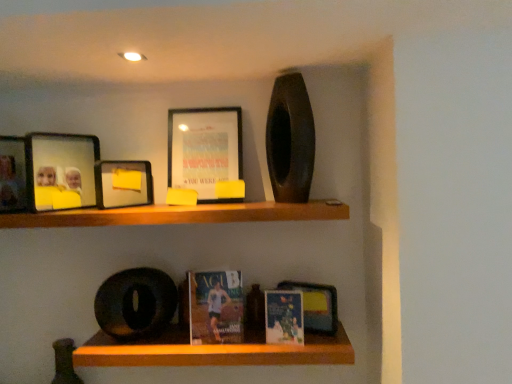
Question: From a real-world perspective, is matte paper book at center, the second paperback book when ordered from left to right, beneath wooden shelf at upper center, placed as the 2th shelf when sorted from bottom to top?

Choices:
 (A) yes
 (B) no

Answer: (A)

Question: Is matte paper book at center, the second paperback book when ordered from left to right, at the left side of wooden shelf at upper center, arranged as the first shelf when viewed from the top?

Choices:
 (A) yes
 (B) no

Answer: (B)

Question: Is matte paper book at center, acting as the first paperback book starting from the right, oriented towards wooden shelf at upper center, placed as the 2th shelf when sorted from bottom to top?

Choices:
 (A) yes
 (B) no

Answer: (B)

Question: Is matte paper book at center, the second paperback book when ordered from left to right, oriented away from wooden shelf at upper center, arranged as the first shelf when viewed from the top?

Choices:
 (A) no
 (B) yes

Answer: (A)

Question: Is matte paper book at center, acting as the first paperback book starting from the right, not inside wooden shelf at upper center, placed as the 2th shelf when sorted from bottom to top?

Choices:
 (A) no
 (B) yes

Answer: (B)

Question: From the image's perspective, is matte plastic picture frame at upper left, arranged as the third picture frame when viewed from the left, positioned above or below wooden shelf at upper center, arranged as the first shelf when viewed from the top?

Choices:
 (A) below
 (B) above

Answer: (B)

Question: In the image, is matte plastic picture frame at upper left, arranged as the third picture frame when viewed from the left, positioned in front of or behind wooden shelf at upper center, arranged as the first shelf when viewed from the top?

Choices:
 (A) front
 (B) behind

Answer: (B)

Question: In terms of size, does matte plastic picture frame at upper left, arranged as the third picture frame when viewed from the left, appear bigger or smaller than wooden shelf at upper center, arranged as the first shelf when viewed from the top?

Choices:
 (A) big
 (B) small

Answer: (B)

Question: Do you think matte plastic picture frame at upper left, the second picture frame viewed from the right, is within wooden shelf at upper center, placed as the 2th shelf when sorted from bottom to top, or outside of it?

Choices:
 (A) inside
 (B) outside

Answer: (B)

Question: From a real-world perspective, relative to matte glass photo frame at upper left, the second picture frame when ordered from left to right, is matte paperback book at center, which ranks as the second paperback book in right-to-left order, vertically above or below?

Choices:
 (A) above
 (B) below

Answer: (B)

Question: Considering the positions of matte paperback book at center, which ranks as the second paperback book in right-to-left order, and matte glass photo frame at upper left, positioned as the 3th picture frame in right-to-left order, in the image, is matte paperback book at center, which ranks as the second paperback book in right-to-left order, wider or thinner than matte glass photo frame at upper left, positioned as the 3th picture frame in right-to-left order,?

Choices:
 (A) wide
 (B) thin

Answer: (A)

Question: Do you think matte paperback book at center, the first paperback book from the left, is within matte glass photo frame at upper left, the second picture frame when ordered from left to right, or outside of it?

Choices:
 (A) outside
 (B) inside

Answer: (A)

Question: Is matte paperback book at center, which ranks as the second paperback book in right-to-left order, in front of or behind matte glass photo frame at upper left, the second picture frame when ordered from left to right, in the image?

Choices:
 (A) front
 (B) behind

Answer: (B)

Question: From a real-world perspective, is matte black picture frame at upper left, which is the first picture frame from left to right, physically located above or below matte paper book at center, acting as the first paperback book starting from the right?

Choices:
 (A) below
 (B) above

Answer: (B)

Question: Is matte black picture frame at upper left, which is the first picture frame from left to right, wider or thinner than matte paper book at center, acting as the first paperback book starting from the right?

Choices:
 (A) thin
 (B) wide

Answer: (A)